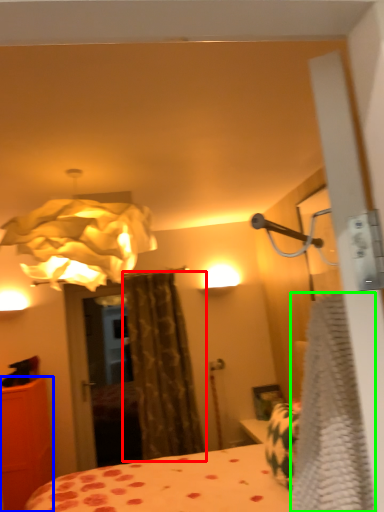
Question: Considering the real-world distances, which object is closest to curtain (highlighted by a red box)? furniture (highlighted by a blue box) or blanket (highlighted by a green box).

Choices:
 (A) furniture
 (B) blanket

Answer: (A)